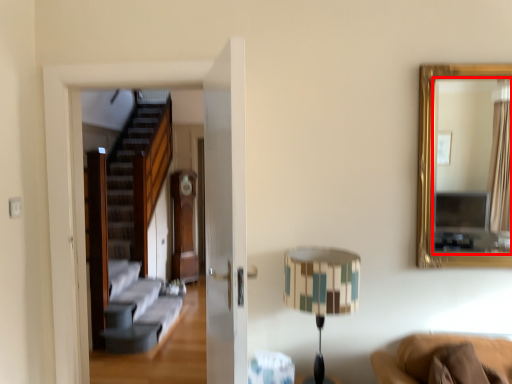
Question: From the image's perspective, where is mirror (annotated by the red box) located in relation to table lamp in the image?

Choices:
 (A) above
 (B) below

Answer: (A)